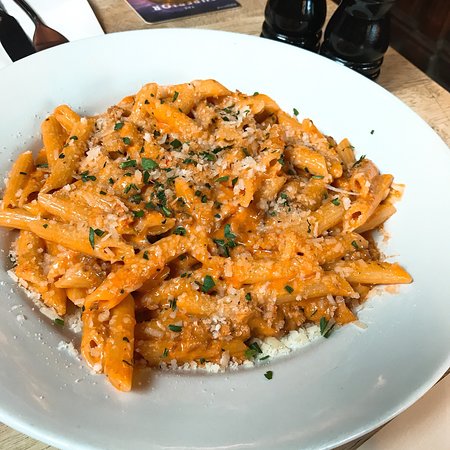
Locate an element on the screen. Image resolution: width=450 pixels, height=450 pixels. plate is located at coordinates (358, 364).